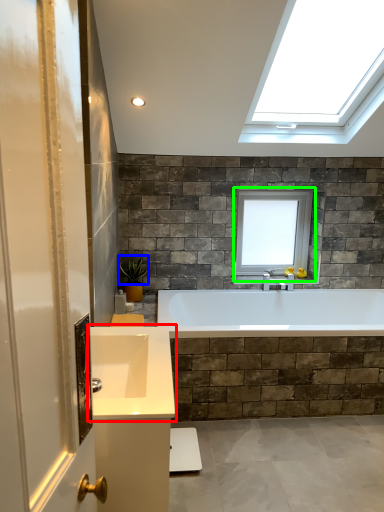
Question: Which object is positioned closest to sink (highlighted by a red box)? Select from plant (highlighted by a blue box) and window (highlighted by a green box).

Choices:
 (A) plant
 (B) window

Answer: (A)